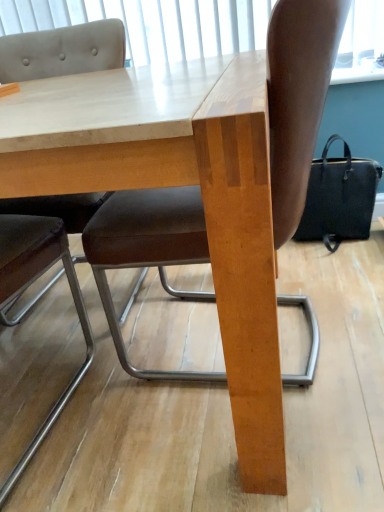
Describe the element at coordinates (298, 98) in the screenshot. This screenshot has width=384, height=512. I see `brown leather chair at center, the 1th chair positioned from the right` at that location.

What are the coordinates of `brown leather chair at upper left, the 1th chair viewed from the left` in the screenshot? It's located at (63, 51).

Image resolution: width=384 pixels, height=512 pixels. I want to click on wooden table at center, so click(x=177, y=185).

From a real-world perspective, is black fabric bag at right positioned over white matte window screen at upper center based on gravity?

Actually, black fabric bag at right is physically below white matte window screen at upper center in the real world.

Can you see black fabric bag at right touching white matte window screen at upper center?

They are not placed beside each other.

Is black fabric bag at right inside or outside of white matte window screen at upper center?

black fabric bag at right exists outside the volume of white matte window screen at upper center.

Does black fabric bag at right come behind white matte window screen at upper center?

Yes.

Based on the photo, which of these two, black fabric bag at right or brown leather chair at center, the 1th chair positioned from the right, is thinner?

Thinner between the two is black fabric bag at right.

Is black fabric bag at right not inside brown leather chair at center, arranged as the second chair when viewed from the left?

Yes, black fabric bag at right is outside of brown leather chair at center, arranged as the second chair when viewed from the left.

From the image's perspective, is black fabric bag at right below brown leather chair at center, arranged as the second chair when viewed from the left?

No, from the image's perspective, black fabric bag at right is not beneath brown leather chair at center, arranged as the second chair when viewed from the left.

Does black fabric bag at right turn towards brown leather chair at center, the 1th chair positioned from the right?

No, black fabric bag at right is not aimed at brown leather chair at center, the 1th chair positioned from the right.

Does brown leather chair at center, the 1th chair positioned from the right, have a smaller size compared to black fabric bag at right?

No, brown leather chair at center, the 1th chair positioned from the right, is not smaller than black fabric bag at right.

From the image's perspective, relative to black fabric bag at right, is brown leather chair at center, the 1th chair positioned from the right, above or below?

From the image's perspective, brown leather chair at center, the 1th chair positioned from the right, appears below black fabric bag at right.

Which is behind, point (133, 227) or point (303, 217)?

The point (303, 217) is behind.

The width and height of the screenshot is (384, 512). In the image, there is a brown leather chair at center, the 1th chair positioned from the right. In order to click on handbag below it (from a real-world perspective) in this screenshot , I will do `click(339, 198)`.

Is wooden table at center completely or partially inside brown leather chair at center, arranged as the second chair when viewed from the left?

No.

Is brown leather chair at center, the 1th chair positioned from the right, oriented towards wooden table at center?

Yes.

In terms of height, does brown leather chair at center, the 1th chair positioned from the right, look taller or shorter compared to wooden table at center?

brown leather chair at center, the 1th chair positioned from the right, is taller than wooden table at center.

Considering the sizes of objects brown leather chair at center, arranged as the second chair when viewed from the left, and wooden table at center in the image provided, who is wider, brown leather chair at center, arranged as the second chair when viewed from the left, or wooden table at center?

wooden table at center is wider.

Is brown leather chair at center, arranged as the second chair when viewed from the left, not close to white matte window screen at upper center?

brown leather chair at center, arranged as the second chair when viewed from the left, is far away from white matte window screen at upper center.

Does brown leather chair at center, arranged as the second chair when viewed from the left, have a smaller size compared to white matte window screen at upper center?

No.

Would you say brown leather chair at center, the 1th chair positioned from the right, contains white matte window screen at upper center?

No, brown leather chair at center, the 1th chair positioned from the right, does not contain white matte window screen at upper center.

How many degrees apart are the facing directions of brown leather chair at center, the 1th chair positioned from the right, and white matte window screen at upper center?

The facing directions of brown leather chair at center, the 1th chair positioned from the right, and white matte window screen at upper center are 93.7 degrees apart.

I want to click on chair behind the wooden table at center, so click(298, 98).

Is wooden table at center next to brown leather chair at center, arranged as the second chair when viewed from the left, and touching it?

No.

Measure the distance from wooden table at center to brown leather chair at center, the 1th chair positioned from the right.

wooden table at center is 9.26 inches away from brown leather chair at center, the 1th chair positioned from the right.

What's the angular difference between wooden table at center and brown leather chair at center, arranged as the second chair when viewed from the left,'s facing directions?

The angular difference between wooden table at center and brown leather chair at center, arranged as the second chair when viewed from the left, is 92.2 degrees.

Does point (93, 240) appear closer or farther from the camera than point (50, 286)?

Point (93, 240) is closer to the camera than point (50, 286).

Is brown leather chair at center, arranged as the second chair when viewed from the left, looking in the opposite direction of brown leather chair at upper left, the 1th chair viewed from the left?

brown leather chair at center, arranged as the second chair when viewed from the left, does not have its back to brown leather chair at upper left, the 1th chair viewed from the left.

From the image's perspective, which is above, brown leather chair at center, arranged as the second chair when viewed from the left, or brown leather chair at upper left, which is counted as the second chair, starting from the right?

From the image's view, brown leather chair at center, arranged as the second chair when viewed from the left, is above.

Where is `handbag lying below the white matte window screen at upper center (from the image's perspective)`? The width and height of the screenshot is (384, 512). handbag lying below the white matte window screen at upper center (from the image's perspective) is located at coordinates (339, 198).

You are a GUI agent. You are given a task and a screenshot of the screen. Output one action in this format:
    pyautogui.click(x=<x>, y=<y>)
    Task: Click on the chair that is the 1st object located in front of the black fabric bag at right
    
    Given the screenshot: What is the action you would take?
    pyautogui.click(x=298, y=98)

Which object lies nearer to the anchor point brown leather chair at upper left, which is counted as the second chair, starting from the right, white matte window screen at upper center or brown leather chair at center, arranged as the second chair when viewed from the left?

Based on the image, white matte window screen at upper center appears to be nearer to brown leather chair at upper left, which is counted as the second chair, starting from the right.

From the image, which object appears to be nearer to brown leather chair at center, the 1th chair positioned from the right, black fabric bag at right or brown leather chair at upper left, which is counted as the second chair, starting from the right?

black fabric bag at right is closer to brown leather chair at center, the 1th chair positioned from the right.

Based on their spatial positions, is brown leather chair at center, the 1th chair positioned from the right, or black fabric bag at right further from wooden table at center?

black fabric bag at right is further to wooden table at center.

Considering their positions, is brown leather chair at center, arranged as the second chair when viewed from the left, positioned closer to white matte window screen at upper center than black fabric bag at right?

Among the two, black fabric bag at right is located nearer to white matte window screen at upper center.

Estimate the real-world distances between objects in this image. Which object is further from black fabric bag at right, brown leather chair at upper left, which is counted as the second chair, starting from the right, or white matte window screen at upper center?

Based on the image, brown leather chair at upper left, which is counted as the second chair, starting from the right, appears to be further to black fabric bag at right.

Considering their positions, is white matte window screen at upper center positioned further to wooden table at center than brown leather chair at upper left, which is counted as the second chair, starting from the right?

white matte window screen at upper center is positioned further to the anchor wooden table at center.

Considering their positions, is brown leather chair at upper left, which is counted as the second chair, starting from the right, positioned further to brown leather chair at center, the 1th chair positioned from the right, than white matte window screen at upper center?

Among the two, white matte window screen at upper center is located further to brown leather chair at center, the 1th chair positioned from the right.

When comparing their distances from brown leather chair at upper left, the 1th chair viewed from the left, does wooden table at center or white matte window screen at upper center seem further?

wooden table at center is further to brown leather chair at upper left, the 1th chair viewed from the left.

Where is `chair positioned between brown leather chair at upper left, the 1th chair viewed from the left, and white matte window screen at upper center from near to far`? This screenshot has width=384, height=512. chair positioned between brown leather chair at upper left, the 1th chair viewed from the left, and white matte window screen at upper center from near to far is located at coordinates (298, 98).

At what (x,y) coordinates should I click in order to perform the action: click on window screen between brown leather chair at center, the 1th chair positioned from the right, and black fabric bag at right from front to back. Please return your answer as a coordinate pair (x, y). Looking at the image, I should click on (152, 24).

The height and width of the screenshot is (512, 384). I want to click on table between brown leather chair at upper left, which is counted as the second chair, starting from the right, and white matte window screen at upper center, along the z-axis, so click(x=177, y=185).

Where is `chair between wooden table at center and white matte window screen at upper center in the front-back direction`? The height and width of the screenshot is (512, 384). chair between wooden table at center and white matte window screen at upper center in the front-back direction is located at coordinates (298, 98).